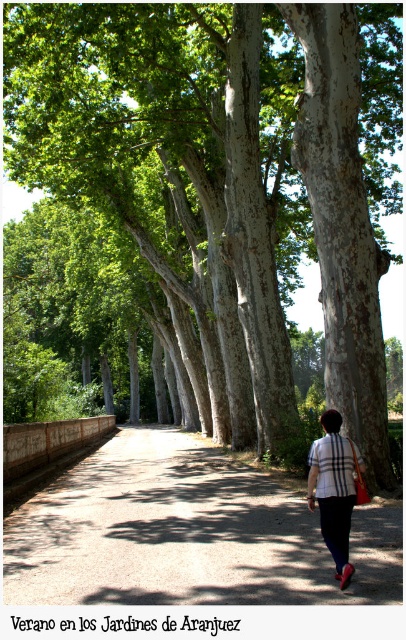
You are standing at the point closer to the camera in the image. Which point are you at, point (129, 550) or point (354, 451)?

You are at point (129, 550) because it is closer to the camera than point (354, 451).